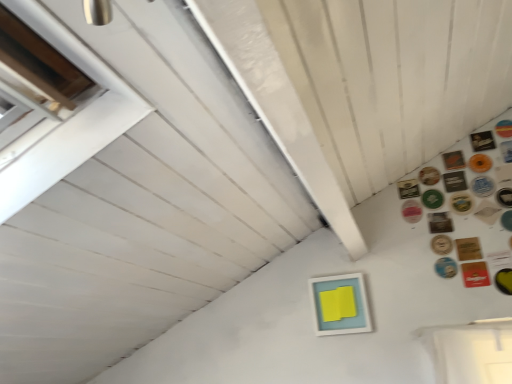
Question: In terms of height, does light blue matte picture frame at center look taller or shorter compared to pink glossy button at upper right, arranged as the 11th button when viewed from the top?

Choices:
 (A) short
 (B) tall

Answer: (B)

Question: Is light blue matte picture frame at center wider or thinner than pink glossy button at upper right, which is the 7th button from bottom to top?

Choices:
 (A) wide
 (B) thin

Answer: (A)

Question: Estimate the real-world distances between objects in this image. Which object is farther from the green rubber button at upper right, which ranks as the 8th button in bottom-to-top order?

Choices:
 (A) matte brown button at upper right, positioned as the thirteenth button in top-to-bottom order
 (B) wooden button at upper right, arranged as the 14th button when viewed from the top
 (C) gold metallic button at upper right, the 7th button positioned from the top
 (D) gold metallic coaster at upper right, marked as the fourth button in a top-to-bottom arrangement
 (E) black matte button at upper right, the sixth button when ordered from bottom to top

Answer: (C)

Question: Based on their relative distances, which object is farther from the blue metallic button at lower right, positioned as the third button in bottom-to-top order?

Choices:
 (A) blue glossy button at upper right, which ranks as the 12th button in bottom-to-top order
 (B) orange matte coaster at upper right, placed as the second button when sorted from top to bottom
 (C) brown leather coaster at upper right, the eighth button viewed from the top
 (D) brown cardboard button at upper right, marked as the 17th button in a bottom-to-top arrangement
 (E) red cardboard button at upper right, which is the 2th button from bottom to top

Answer: (D)